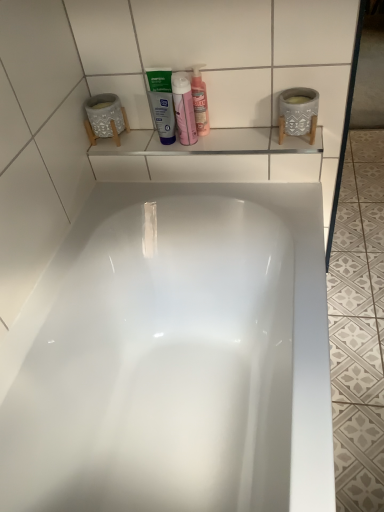
Find the location of a particular element. vacant space that is to the left of white matte tube at center is located at coordinates (128, 144).